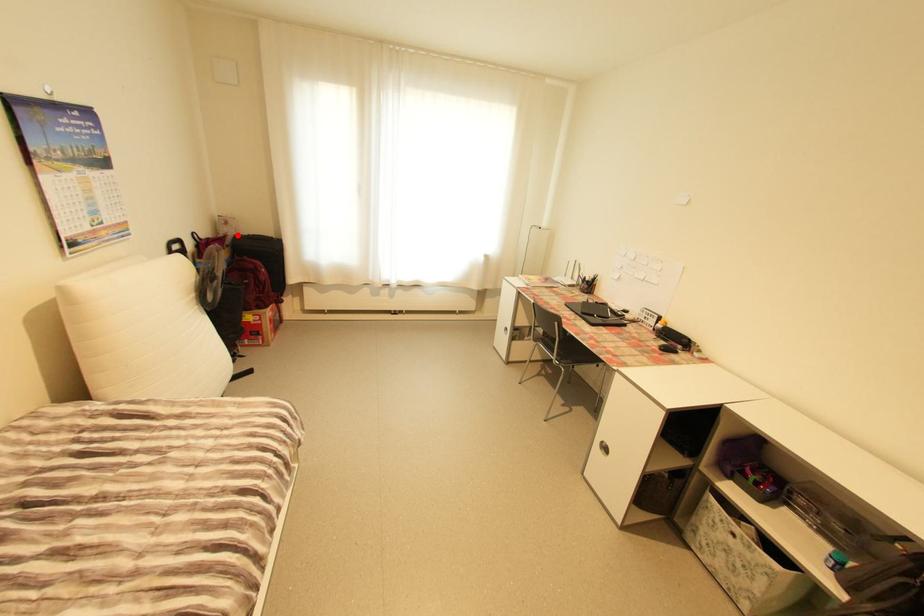
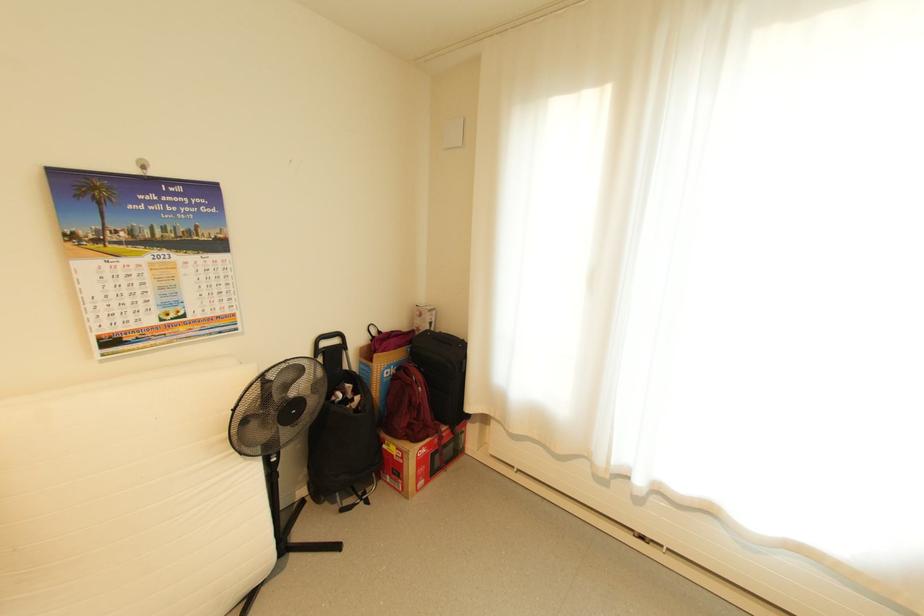
Where in the second image is the point corresponding to the highlighted location from the first image?

(429, 330)